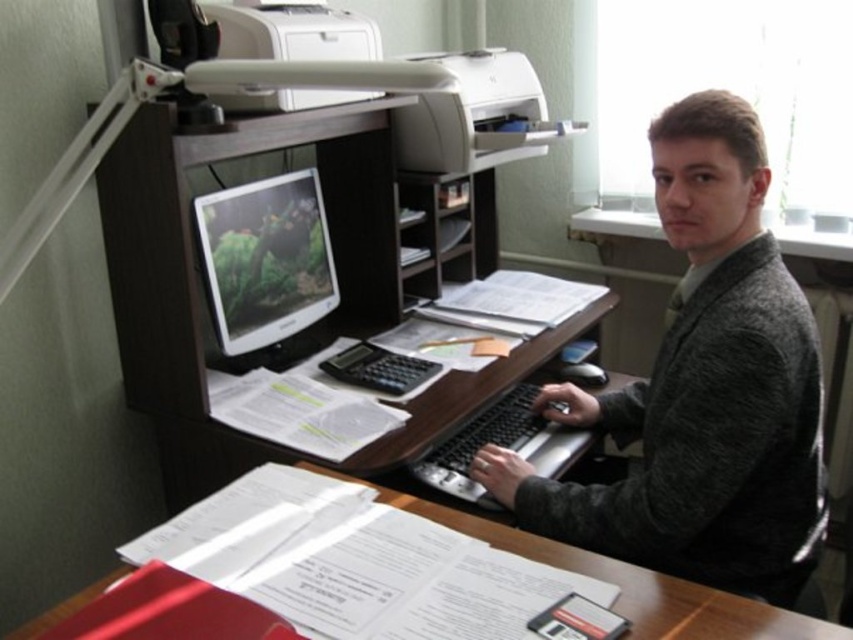
Which of these two, wooden desk at center or white matte printer at upper center, stands taller?

With more height is white matte printer at upper center.

Does point (843, 628) come closer to viewer compared to point (241, 38)?

Yes, point (843, 628) is in front of point (241, 38).

You are a GUI agent. You are given a task and a screenshot of the screen. Output one action in this format:
    pyautogui.click(x=<x>, y=<y>)
    Task: Click on the wooden desk at center
    
    Given the screenshot: What is the action you would take?
    pyautogui.click(x=625, y=580)

Does matte black monitor at center have a lesser height compared to white matte printer at upper center?

No, matte black monitor at center is not shorter than white matte printer at upper center.

Can you confirm if matte black monitor at center is bigger than white matte printer at upper center?

No.

Is point (282, 216) less distant than point (218, 22)?

No, (282, 216) is further to viewer.

Locate an element on the screen. Image resolution: width=853 pixels, height=640 pixels. matte black monitor at center is located at coordinates (265, 262).

Does white plastic printer at upper center lie behind wooden desk at center?

Yes, it is.

Who is positioned more to the right, white plastic printer at upper center or wooden desk at center?

white plastic printer at upper center is more to the right.

Is point (483, 97) behind point (827, 625)?

That is True.

Image resolution: width=853 pixels, height=640 pixels. Identify the location of white plastic printer at upper center. [x=421, y=100].